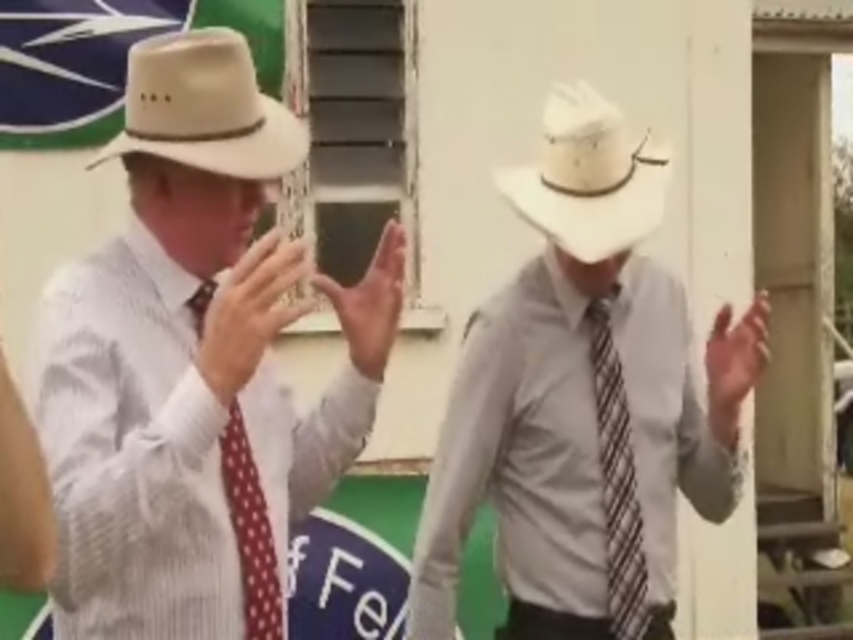
You are a photographer at a western themed event. You need to capture a photo where the matte white cowboy hat at center and the brown striped tie at center are both visible. Based on their positions, which object should appear higher in the photo?

The matte white cowboy hat at center is located above the brown striped tie at center, so it should appear higher in the photo.

You are a photographer trying to capture a clear shot of the polka dot fabric tie at left. However, the beige felt fedora at upper left is blocking your view. Can you adjust your position to see the tie without moving the subjects?

The beige felt fedora at upper left is in front of the polka dot fabric tie at left, so adjusting your position to the side or slightly behind the subjects might allow you to see the tie without obstruction.

Based on the coordinates provided, which object corresponds to the point at (581, 388)?

The point at (581, 388) corresponds to the matte white cowboy hat at center.